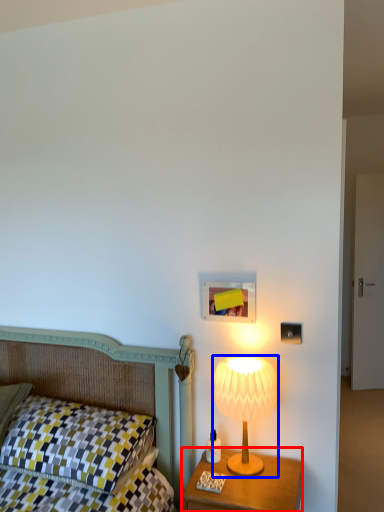
Question: Which of the following is the closest to the observer, nightstand (highlighted by a red box) or lamp (highlighted by a blue box)?

Choices:
 (A) nightstand
 (B) lamp

Answer: (A)